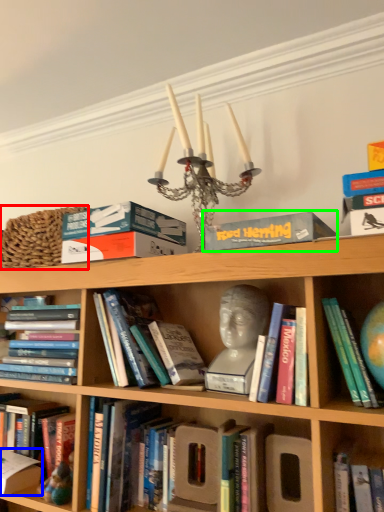
Question: Considering the real-world distances, which object is closest to basket (highlighted by a red box)? paperback book (highlighted by a blue box) or paperback book (highlighted by a green box).

Choices:
 (A) paperback book
 (B) paperback book

Answer: (B)